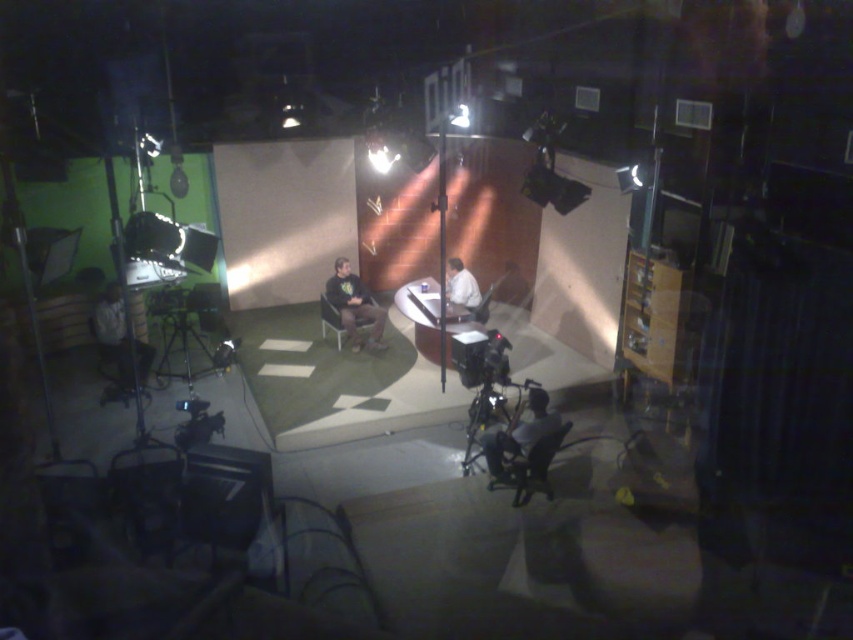
Question: Which point is farther to the camera?

Choices:
 (A) matte black chair at lower center
 (B) matte black chair at center
 (C) dark gray fabric chair at lower left

Answer: (B)

Question: Where is dark gray shirt at lower right located in relation to white fabric shirt at center in the image?

Choices:
 (A) below
 (B) above

Answer: (A)

Question: Does dark gray fabric chair at lower left have a larger size compared to matte black chair at lower center?

Choices:
 (A) no
 (B) yes

Answer: (B)

Question: Which of the following is the farthest from the observer?

Choices:
 (A) (103, 330)
 (B) (337, 275)

Answer: (B)

Question: Where is dark gray fabric chair at lower left located in relation to dark gray fabric chair at center in the image?

Choices:
 (A) below
 (B) above

Answer: (A)

Question: Which point is closer to the camera?

Choices:
 (A) dark gray fabric chair at center
 (B) dark gray shirt at lower right
 (C) matte black chair at lower center

Answer: (C)